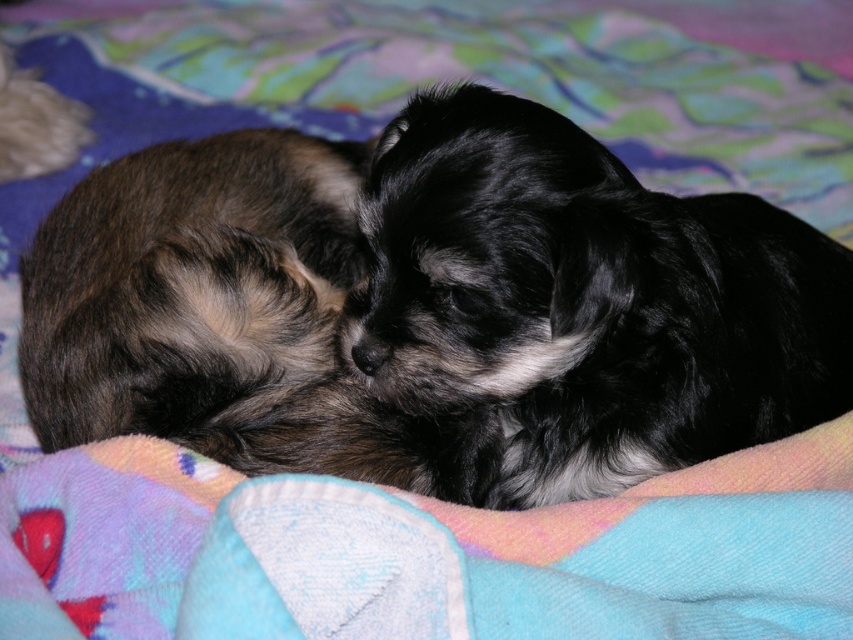
Looking at this image, you are a photographer trying to capture a closeup of both the black fluffy dog at center and the soft brown fur at upper left. Since you want to focus on both, which dog should you adjust your camera lens to prioritize focusing on first?

The black fluffy dog at center is much taller than the soft brown fur at upper left, so you should prioritize focusing on the black fluffy dog at center first because it is closer to the camera.

You are a dog trainer observing two puppies on a blanket. You need to determine which puppy is wider. The puppies are the black fluffy dog at center and the soft brown fur at upper left. Can you tell me which one is wider?

The black fluffy dog at center is wider than the soft brown fur at upper left because its width surpasses the other puppy.

Looking at this image, you are a photographer taking a picture of the black fluffy dog at center and the soft brown fur at upper left. Which dog should you focus on if you want to capture the larger one in the image?

The black fluffy dog at center is larger in size than the soft brown fur at upper left, so you should focus on the black fluffy dog at center to capture the larger one.